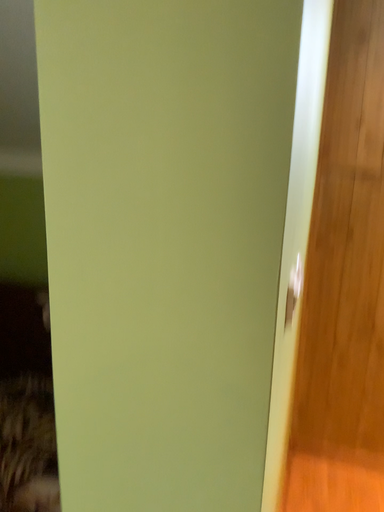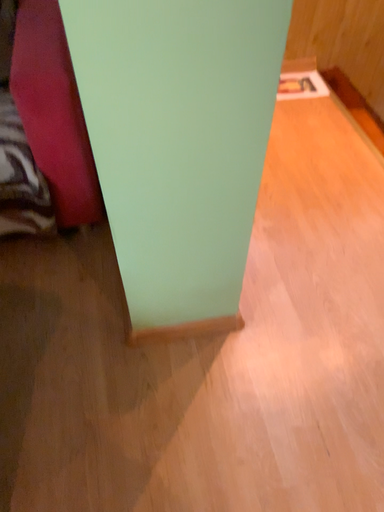
Question: Which way did the camera rotate in the video?

Choices:
 (A) rotated upward
 (B) rotated downward

Answer: (B)